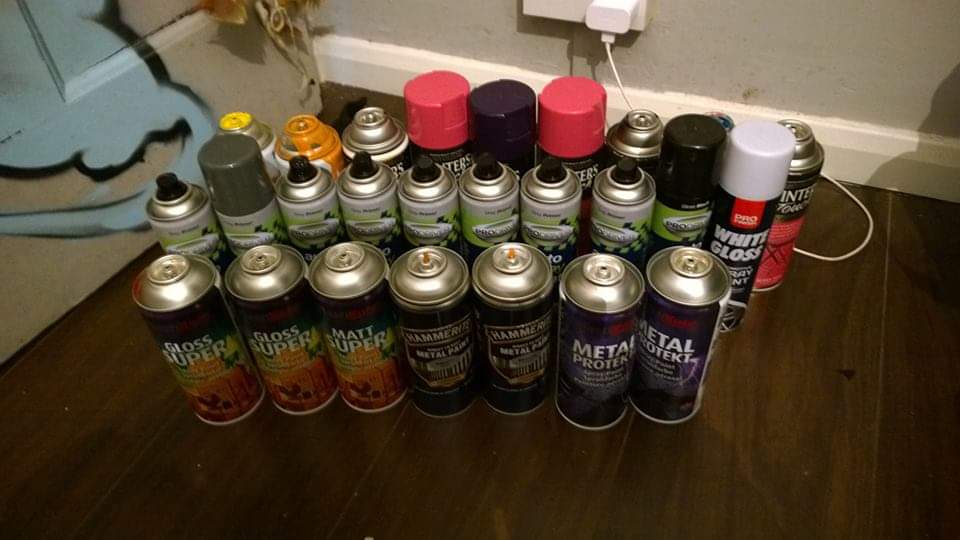
Identify the location of wood flor. The image size is (960, 540). (87, 397).